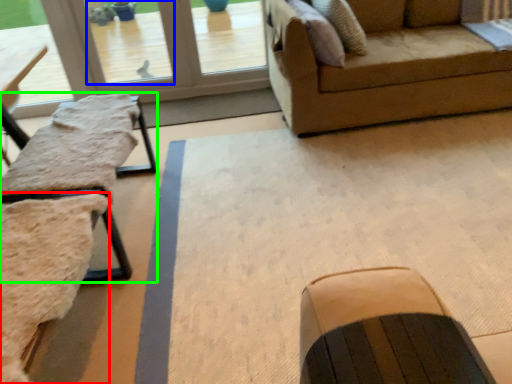
Question: Estimate the real-world distances between objects in this image. Which object is farther from swivel chair (highlighted by a red box), window screen (highlighted by a blue box) or table (highlighted by a green box)?

Choices:
 (A) window screen
 (B) table

Answer: (A)